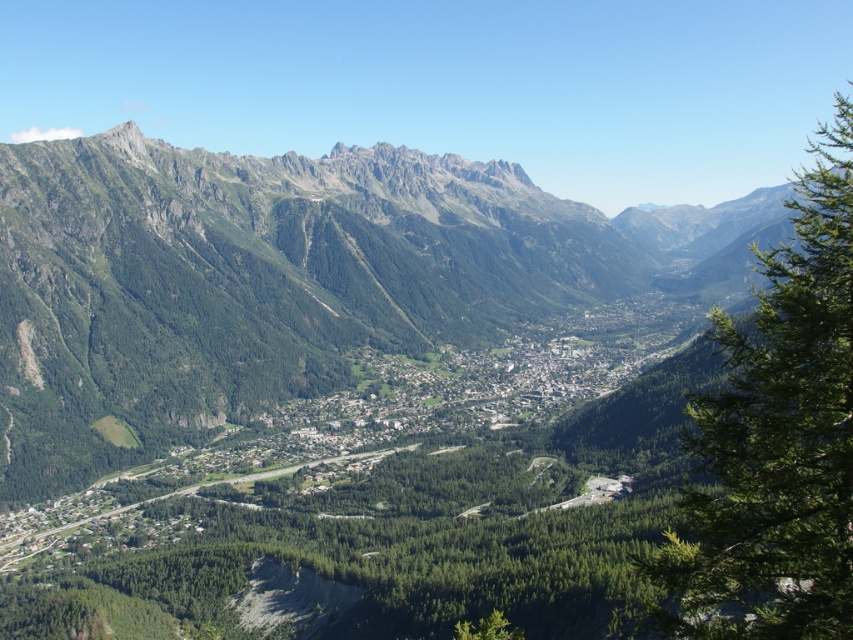
You are planning a hiking route and need to decide between two landmarks visible from your current position in the mountainous landscape. The landmarks are the green textured mountain range at center and the green leafy tree at right. Which landmark has a larger horizontal spread from your viewpoint?

The green textured mountain range at center might be wider than green leafy tree at right, so the mountain range likely has a larger horizontal spread from your viewpoint.

You are a hiker standing at the point marked by the coordinates point (286,280). Looking around, you see the green textured mountain range at center. Which direction should you head to reach the valley below?

The point (286,280) corresponds to the green textured mountain range at center. To reach the valley below, you should head downward from the mountain range towards the valley.